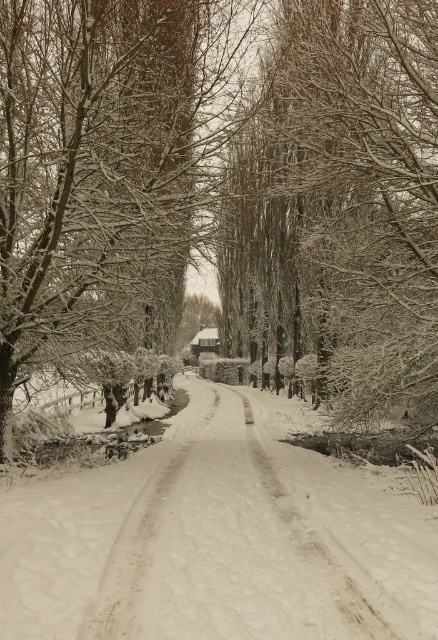
Question: Which point is farther to the camera?

Choices:
 (A) [x=388, y=76]
 (B) [x=371, y=100]
 (C) [x=275, y=556]

Answer: (A)

Question: Does snow-covered branches at center have a larger size compared to snow-covered trees at center?

Choices:
 (A) yes
 (B) no

Answer: (A)

Question: Is snow-covered trees at center thinner than white snow-covered path at center?

Choices:
 (A) yes
 (B) no

Answer: (B)

Question: Which is farther from the snow-covered branches at center?

Choices:
 (A) snow-covered trees at center
 (B) white snow-covered path at center

Answer: (B)

Question: Which point is farther from the camera taking this photo?

Choices:
 (A) (314, 314)
 (B) (264, 492)

Answer: (A)

Question: Does snow-covered branches at center have a smaller size compared to snow-covered trees at center?

Choices:
 (A) yes
 (B) no

Answer: (B)